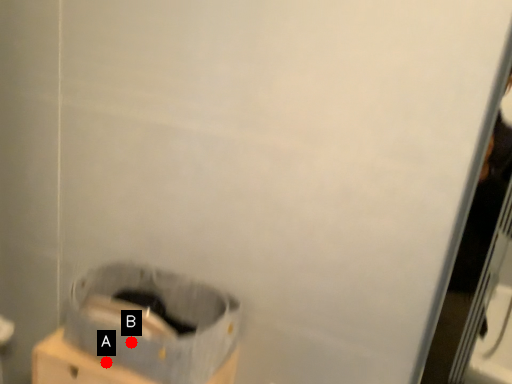
Question: Two points are circled on the image, labeled by A and B beside each circle. Which of the following is the closest to the observer?

Choices:
 (A) A is closer
 (B) B is closer

Answer: (B)